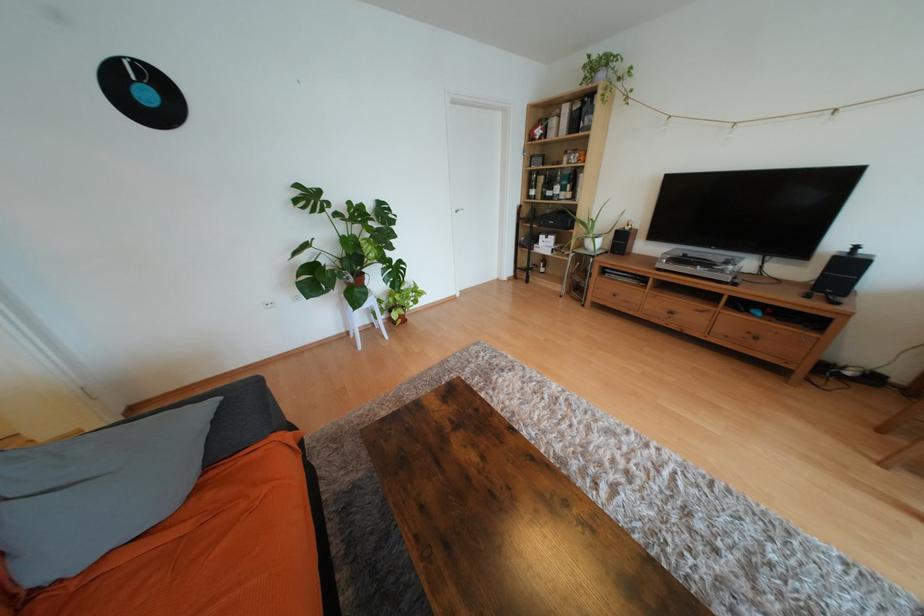
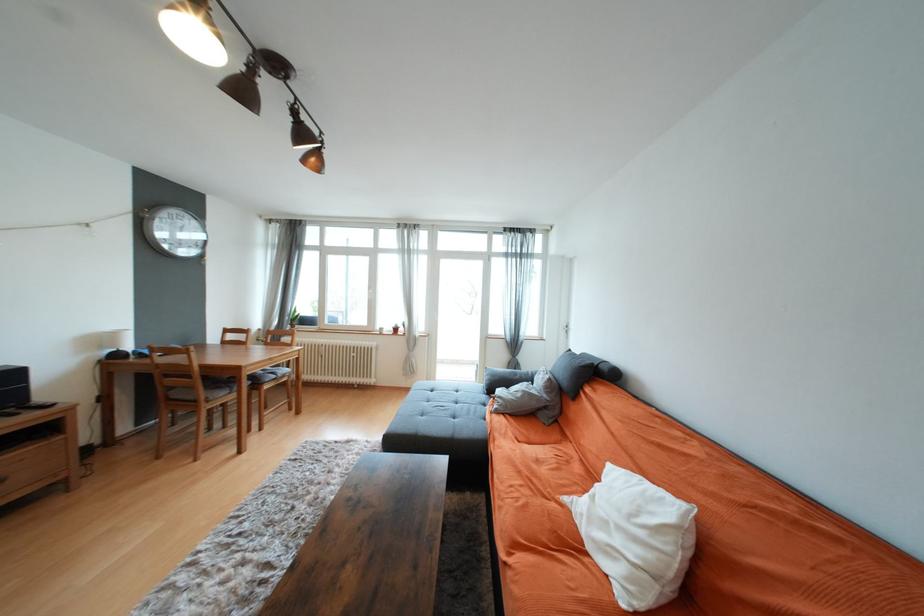
The point at (762, 339) is marked in the first image. Where is the corresponding point in the second image?

(7, 482)